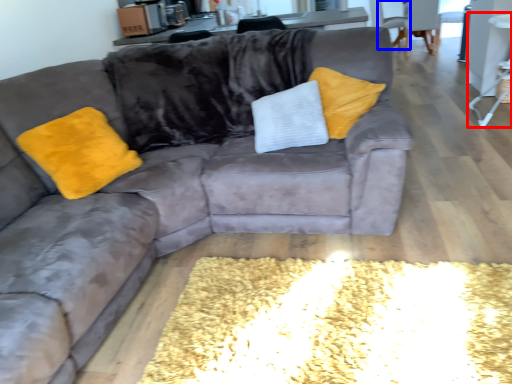
Question: Which of the following is the closest to the observer, side table (highlighted by a red box) or armchair (highlighted by a blue box)?

Choices:
 (A) side table
 (B) armchair

Answer: (A)